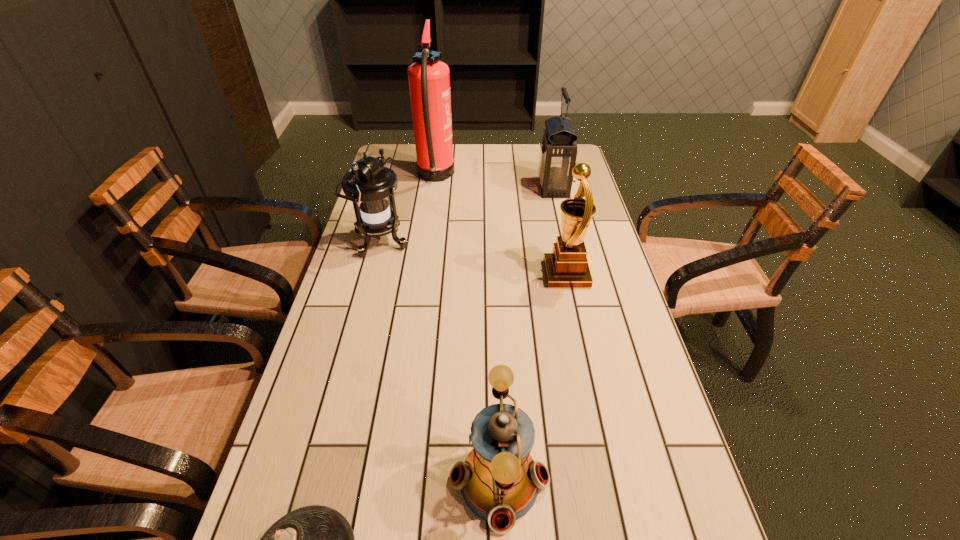
Find the location of a particular element. This screenshot has width=960, height=540. vacant space located on the front-facing side of the rightmost lantern is located at coordinates (508, 188).

The width and height of the screenshot is (960, 540). I want to click on vacant space positioned 0.100m on the front-facing side of the rightmost lantern, so click(511, 188).

Image resolution: width=960 pixels, height=540 pixels. I want to click on free space located on the front-facing side of the rightmost lantern, so click(466, 188).

Locate an element on the screen. The image size is (960, 540). vacant space located on the right of the second farthest lantern is located at coordinates (452, 242).

Locate an element on the screen. blank space located on the front-facing side of the fourth object from left to right is located at coordinates 312,481.

This screenshot has width=960, height=540. Identify the location of vacant space located 0.180m on the front-facing side of the fourth object from left to right. (358, 481).

Find the location of a particular element. This screenshot has height=540, width=960. free spot located on the front-facing side of the fourth object from left to right is located at coordinates (409, 481).

I want to click on object that is at the far edge, so click(x=429, y=78).

In order to click on fire extinguisher present at the left edge in this screenshot , I will do `click(429, 78)`.

Identify the location of lantern situated at the left edge. This screenshot has width=960, height=540. click(x=369, y=185).